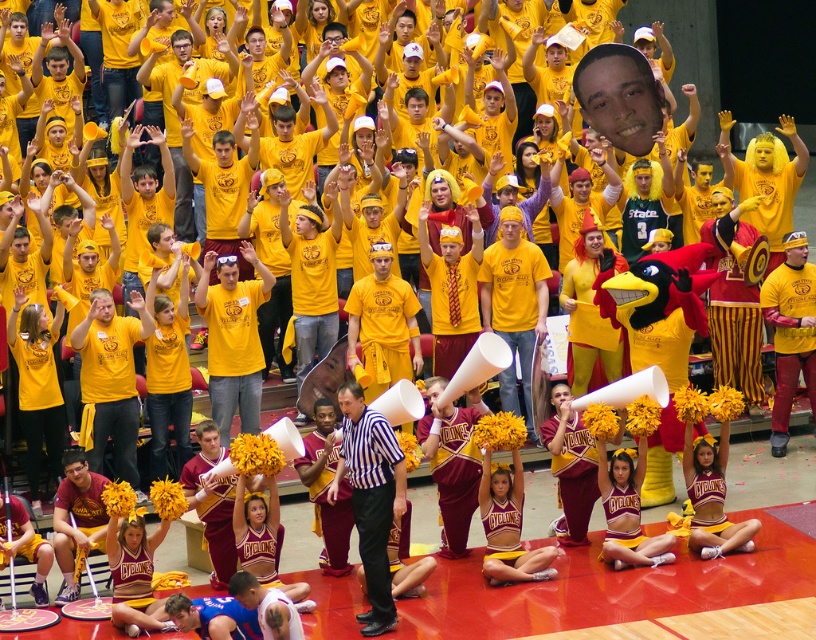
You are a photographer trying to capture a photo of both the black striped shirt at center and the maroon jersey at lower left. Based on their positions, which one should you focus on first to ensure both are in the frame?

The maroon jersey at lower left should be focused on first since the black striped shirt at center is to the right of it, meaning adjusting the frame to include the maroon jersey will naturally include the black striped shirt as well.

You are a photographer positioned at the center of the gymnasium floor. You want to take a photo of the maroon jersey at lower left. Which direction should you move to get a better shot of it?

Since the maroon jersey at lower left is located at point 0.812 on the x axis and 0.094 on the y axis, you should move to the left and slightly forward to position yourself closer to the jersey for a better shot.

You are a photographer positioned at the back of the gym. You want to take a photo of both the black striped shirt at center and the yellow jersey at center. Which one is closer to you?

The black striped shirt at center is in front of the yellow jersey at center, so it is closer to you.